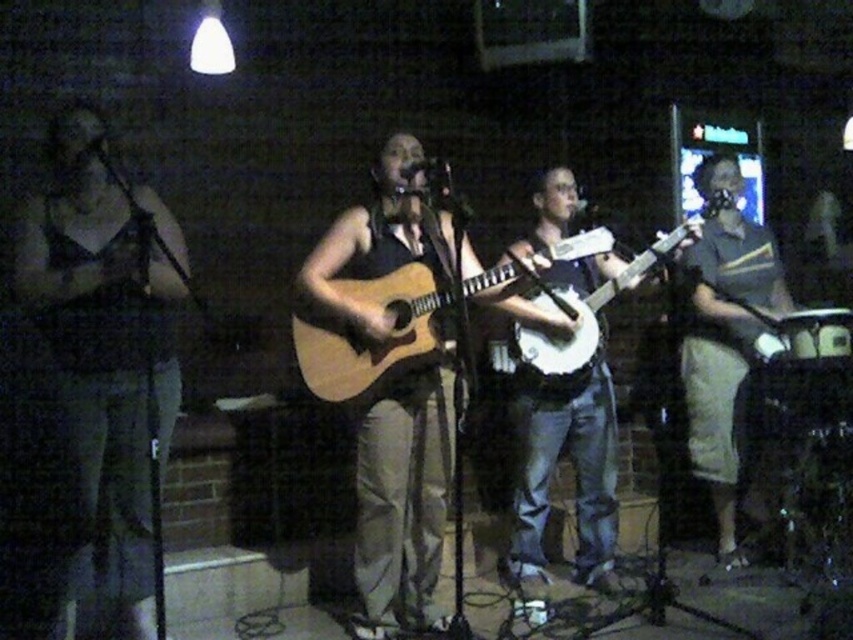
You are a photographer in the audience of the live music performance. You want to capture a photo that includes both the matte black tank top at left and the white wood banjo at center. Which object should you adjust your camera focus to ensure both are in frame?

The matte black tank top at left is larger in size compared to the white wood banjo at center. To ensure both are in frame, adjust the camera focus to prioritize the larger object, which is the matte black tank top at left, as it requires more space.

You are a photographer at the live music performance. You want to capture a photo where the beige fabric skirt at right and the white wood banjo at center are both visible. Based on their heights, which object will appear larger in the photo?

The beige fabric skirt at right is taller than the white wood banjo at center, so it will appear larger in the photo.

You are a photographer positioned at the origin point of the coordinate system. You want to capture a closeup shot of the light brown acoustic guitar at center. What are the coordinates where you should aim your camera?

The coordinates to aim your camera are at point (x=392, y=326) to capture the light brown acoustic guitar at center.